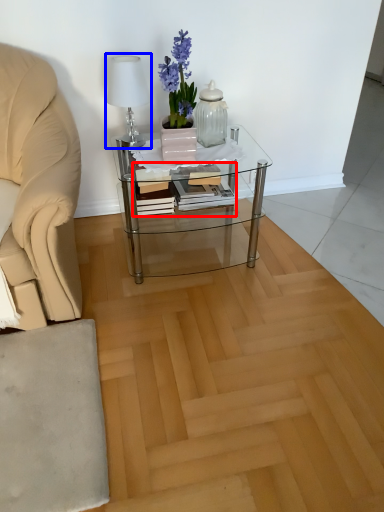
Question: Among these objects, which one is farthest to the camera, book (highlighted by a red box) or table lamp (highlighted by a blue box)?

Choices:
 (A) book
 (B) table lamp

Answer: (A)